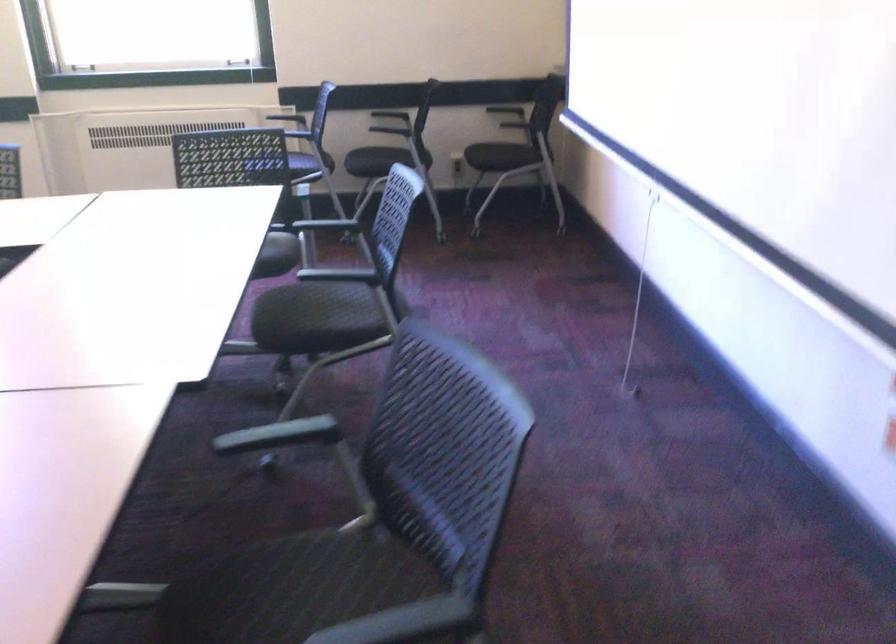
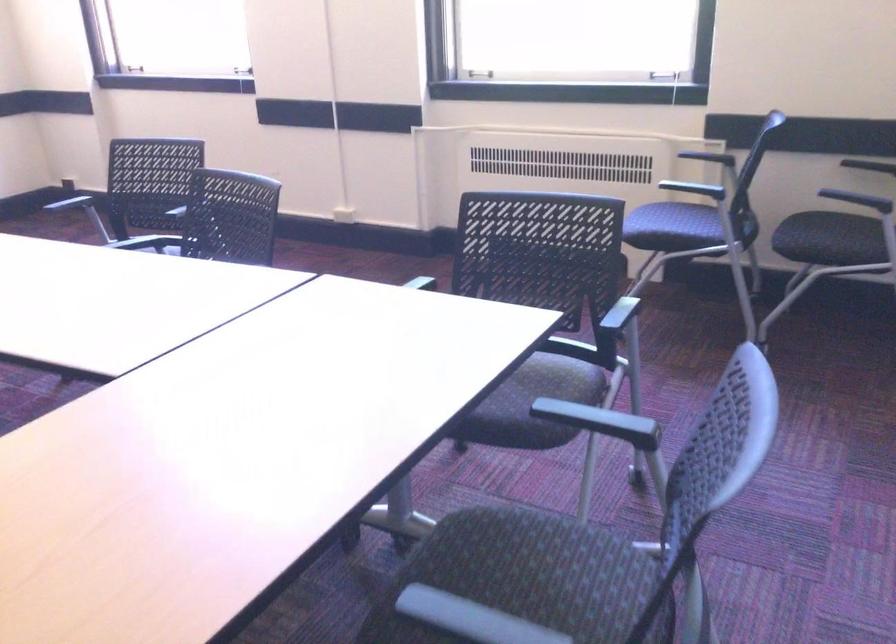
Where in the second image is the point corresponding to point (309, 294) from the first image?

(533, 556)